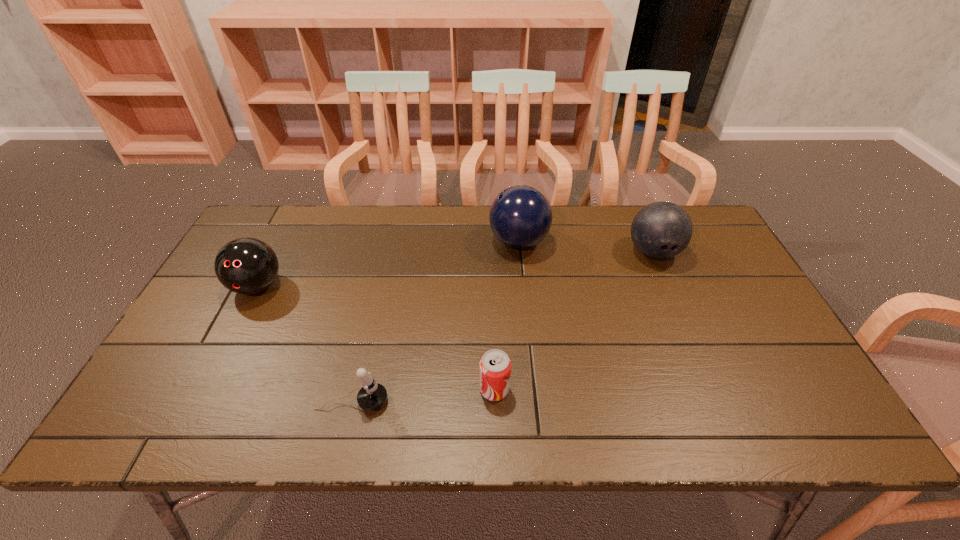
Locate an element on the screen. free region located on the right of the microphone is located at coordinates point(487,402).

The width and height of the screenshot is (960, 540). Identify the location of vacant space positioned on the left of the soda can. (366, 389).

In order to click on microphone located in the near edge section of the desktop in this screenshot , I will do `click(372, 396)`.

Identify the location of soda can present at the near edge. The image size is (960, 540). (495, 366).

Find the location of a particular element. The height and width of the screenshot is (540, 960). object present at the left edge is located at coordinates (246, 265).

What are the coordinates of `object present at the right edge` in the screenshot? It's located at 660,230.

In order to click on object situated at the far right corner in this screenshot , I will do `click(660, 230)`.

In the image, there is a desktop. Where is `vacant space at the far edge`? This screenshot has width=960, height=540. vacant space at the far edge is located at coordinates (330, 217).

This screenshot has width=960, height=540. In order to click on free space at the near edge in this screenshot , I will do `click(543, 402)`.

In the image, there is a desktop. Where is `free space at the left edge`? free space at the left edge is located at coordinates (242, 300).